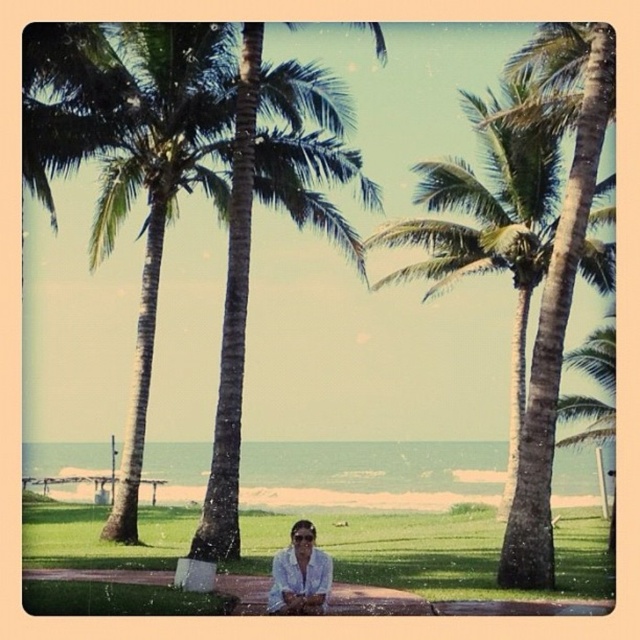
Question: Which point is closer to the camera?

Choices:
 (A) (296, 593)
 (B) (230, 300)
 (C) (467, 259)
 (D) (83, 33)

Answer: (A)

Question: Which point appears farthest from the camera in this image?

Choices:
 (A) (196, 108)
 (B) (216, 412)

Answer: (A)

Question: Which object is positioned closest to the green leafy palm tree at right?

Choices:
 (A) white matte shirt at lower center
 (B) green leafy palm tree at left
 (C) green leafy palm tree at center

Answer: (C)

Question: Considering the relative positions of green leafy palm tree at center and white matte shirt at lower center in the image provided, where is green leafy palm tree at center located with respect to white matte shirt at lower center?

Choices:
 (A) above
 (B) below

Answer: (A)

Question: Does green leafy palm tree at center have a larger size compared to white matte shirt at lower center?

Choices:
 (A) no
 (B) yes

Answer: (B)

Question: Does green leafy palm tree at left have a lesser width compared to white matte shirt at lower center?

Choices:
 (A) no
 (B) yes

Answer: (A)